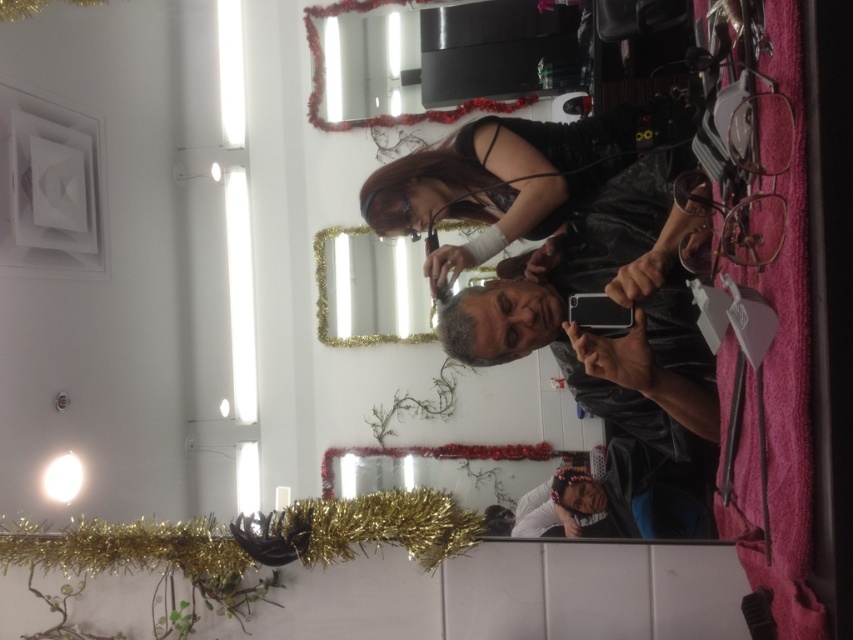
Question: Does shiny black phone at center appear over black leather jacket at center?

Choices:
 (A) yes
 (B) no

Answer: (B)

Question: Is shiny black phone at center positioned behind black leather jacket at center?

Choices:
 (A) yes
 (B) no

Answer: (B)

Question: Can you confirm if shiny black phone at center is wider than black leather jacket at center?

Choices:
 (A) yes
 (B) no

Answer: (B)

Question: Which point is closer to the camera taking this photo?

Choices:
 (A) (567, 252)
 (B) (341, 332)
 (C) (512, 212)

Answer: (A)

Question: Which point is closer to the camera?

Choices:
 (A) shiny black phone at center
 (B) black leather jacket at center

Answer: (A)

Question: Which point is farther to the camera?

Choices:
 (A) (566, 280)
 (B) (582, 195)

Answer: (B)